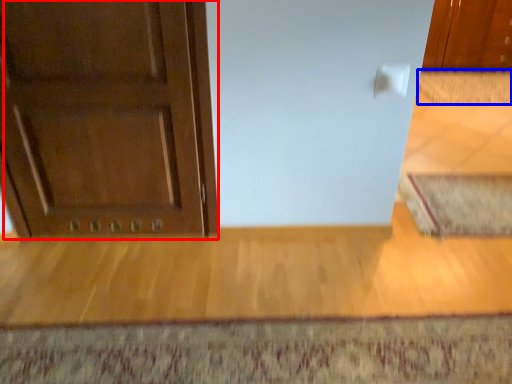
Question: Which point is further to the camera, door (highlighted by a red box) or doormat (highlighted by a blue box)?

Choices:
 (A) door
 (B) doormat

Answer: (B)